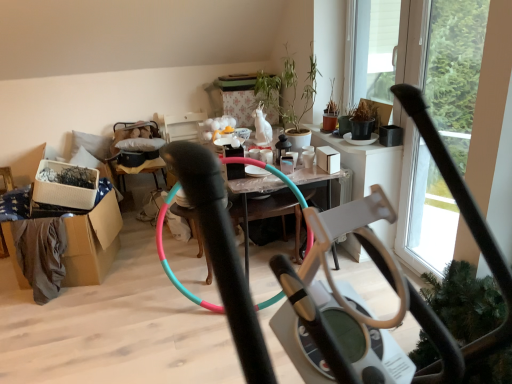
Question: Can you confirm if transparent glass window screen at upper right is positioned to the right of wooden cushioned armchair at center-left?

Choices:
 (A) no
 (B) yes

Answer: (B)

Question: From a real-world perspective, is transparent glass window screen at upper right positioned over wooden cushioned armchair at center-left based on gravity?

Choices:
 (A) yes
 (B) no

Answer: (A)

Question: Considering the relative sizes of transparent glass window screen at upper right and wooden cushioned armchair at center-left in the image provided, is transparent glass window screen at upper right wider than wooden cushioned armchair at center-left?

Choices:
 (A) yes
 (B) no

Answer: (B)

Question: Is transparent glass window screen at upper right smaller than wooden cushioned armchair at center-left?

Choices:
 (A) yes
 (B) no

Answer: (A)

Question: From the image's perspective, is transparent glass window screen at upper right above wooden cushioned armchair at center-left?

Choices:
 (A) no
 (B) yes

Answer: (B)

Question: Is transparent glass window screen at upper right further to camera compared to wooden cushioned armchair at center-left?

Choices:
 (A) yes
 (B) no

Answer: (B)

Question: Could you tell me if matte black pot at upper right is turned towards green matte plant at upper center?

Choices:
 (A) no
 (B) yes

Answer: (B)

Question: Is the position of matte black pot at upper right less distant than that of green matte plant at upper center?

Choices:
 (A) no
 (B) yes

Answer: (A)

Question: Does matte black pot at upper right have a lesser width compared to green matte plant at upper center?

Choices:
 (A) yes
 (B) no

Answer: (A)

Question: Considering the relative sizes of matte black pot at upper right and green matte plant at upper center in the image provided, is matte black pot at upper right shorter than green matte plant at upper center?

Choices:
 (A) no
 (B) yes

Answer: (B)

Question: Is matte black pot at upper right positioned with its back to green matte plant at upper center?

Choices:
 (A) no
 (B) yes

Answer: (A)

Question: From a real-world perspective, is matte black pot at upper right physically below green matte plant at upper center?

Choices:
 (A) yes
 (B) no

Answer: (A)

Question: Is translucent plastic table at center not inside wooden cushioned armchair at center-left?

Choices:
 (A) no
 (B) yes

Answer: (B)